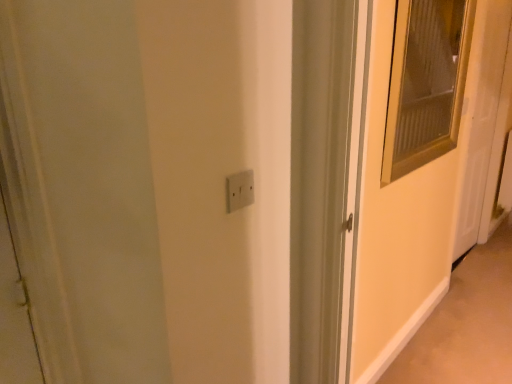
Question: Is the position of beige carpet at lower right more distant than that of white glossy door at right?

Choices:
 (A) yes
 (B) no

Answer: (B)

Question: Is beige carpet at lower right facing towards white glossy door at right?

Choices:
 (A) yes
 (B) no

Answer: (B)

Question: Is beige carpet at lower right to the left of white glossy door at right from the viewer's perspective?

Choices:
 (A) yes
 (B) no

Answer: (B)

Question: Can you confirm if beige carpet at lower right is smaller than white glossy door at right?

Choices:
 (A) no
 (B) yes

Answer: (B)

Question: Is white glossy door at right inside beige carpet at lower right?

Choices:
 (A) yes
 (B) no

Answer: (B)

Question: Can we say beige carpet at lower right lies outside white glossy door at right?

Choices:
 (A) yes
 (B) no

Answer: (A)

Question: Is white plastic electric outlet at center thinner than beige carpet at lower right?

Choices:
 (A) no
 (B) yes

Answer: (B)

Question: Is beige carpet at lower right inside white plastic electric outlet at center?

Choices:
 (A) no
 (B) yes

Answer: (A)

Question: Considering the relative sizes of white plastic electric outlet at center and beige carpet at lower right in the image provided, is white plastic electric outlet at center taller than beige carpet at lower right?

Choices:
 (A) yes
 (B) no

Answer: (A)

Question: Considering the relative sizes of white plastic electric outlet at center and beige carpet at lower right in the image provided, is white plastic electric outlet at center smaller than beige carpet at lower right?

Choices:
 (A) yes
 (B) no

Answer: (A)

Question: From the image's perspective, would you say white plastic electric outlet at center is positioned over beige carpet at lower right?

Choices:
 (A) yes
 (B) no

Answer: (A)

Question: Is white plastic electric outlet at center closer to camera compared to beige carpet at lower right?

Choices:
 (A) yes
 (B) no

Answer: (A)

Question: Is white glossy door at right shorter than matte glass screen door at right?

Choices:
 (A) yes
 (B) no

Answer: (B)